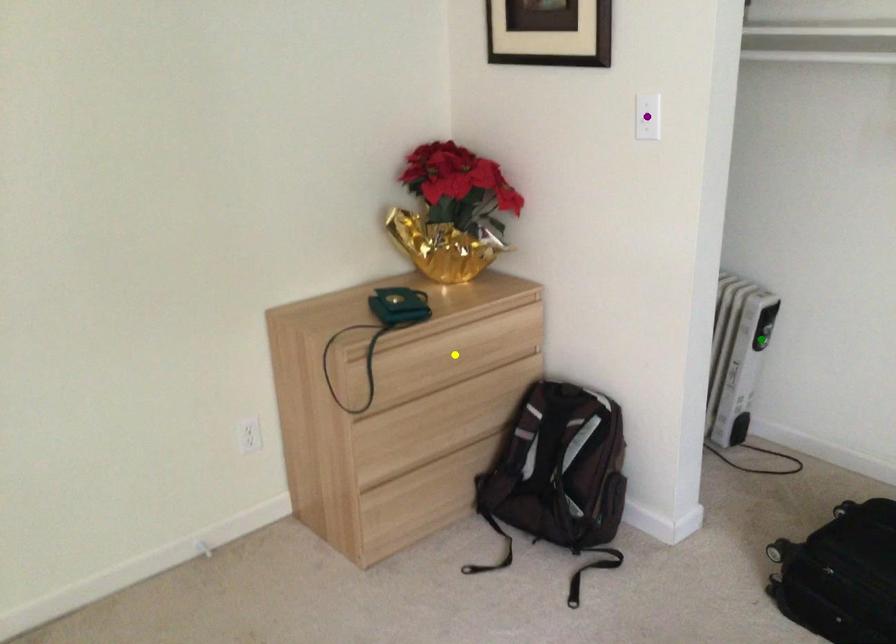
Based on the photo, order these from farthest to nearest:
A) green point
B) purple point
C) yellow point

green point → yellow point → purple point